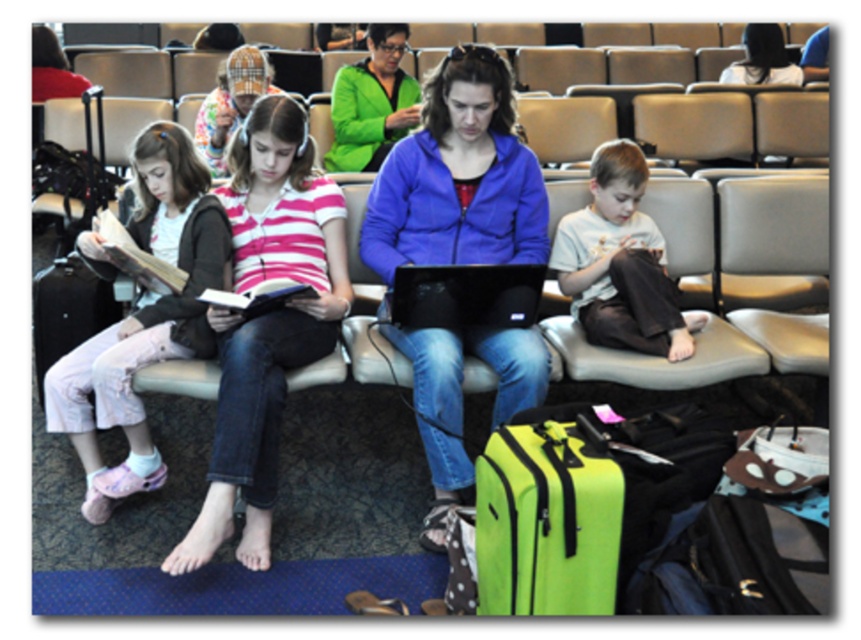
You are a traveler who needs to access the black matte laptop at center in the airport waiting area. The green matte jacket at center is blocking your path. Can you reach the laptop without moving the jacket?

The black matte laptop at center is behind the green matte jacket at center, so you can reach the laptop without moving the jacket by going around it or accessing from the back side.